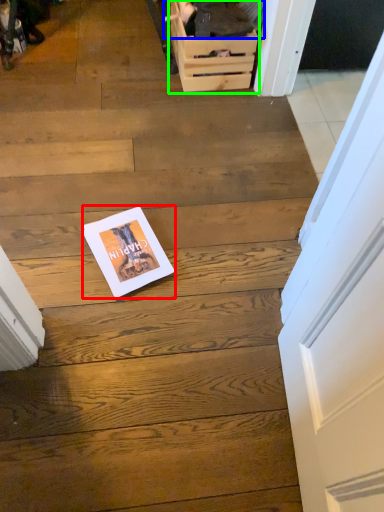
Question: Estimate the real-world distances between objects in this image. Which object is farther from magazine (highlighted by a red box), couple (highlighted by a blue box) or drawer (highlighted by a green box)?

Choices:
 (A) couple
 (B) drawer

Answer: (A)